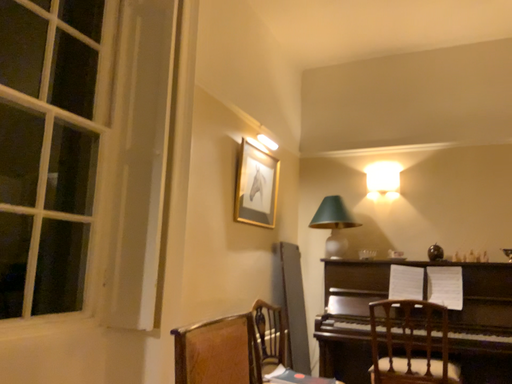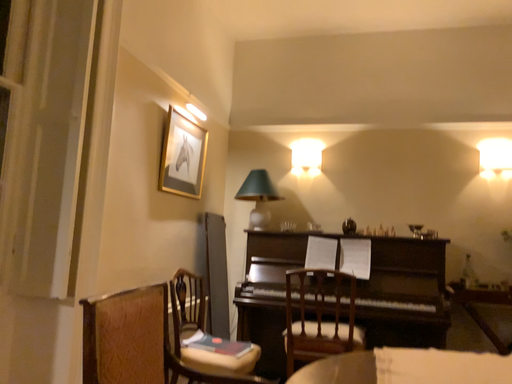
Question: Which way did the camera rotate in the video?

Choices:
 (A) rotated left
 (B) rotated right

Answer: (B)